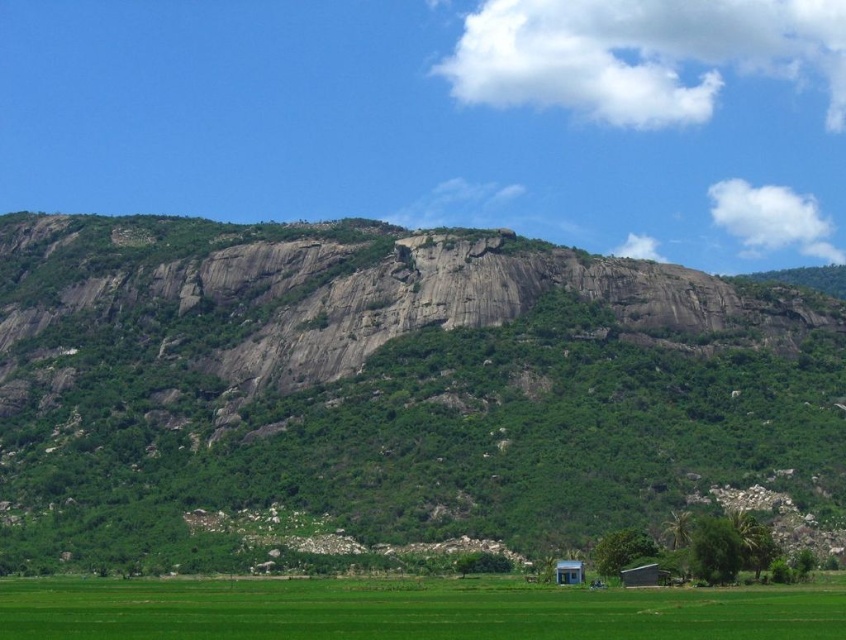
Question: Among these objects, which one is nearest to the camera?

Choices:
 (A) blue painted wood hut at lower center
 (B) white corrugated metal hut at lower right

Answer: (B)

Question: Considering the relative positions of green grass field at lower center and blue painted wood hut at lower center in the image provided, where is green grass field at lower center located with respect to blue painted wood hut at lower center?

Choices:
 (A) left
 (B) right

Answer: (A)

Question: Which point is closer to the camera taking this photo?

Choices:
 (A) [x=580, y=577]
 (B) [x=25, y=584]

Answer: (A)

Question: Does gray rock mountain at center appear on the left side of white corrugated metal hut at lower right?

Choices:
 (A) yes
 (B) no

Answer: (A)

Question: Can you confirm if green grass field at lower center is smaller than white corrugated metal hut at lower right?

Choices:
 (A) yes
 (B) no

Answer: (B)

Question: Which of the following is the closest to the observer?

Choices:
 (A) blue painted wood hut at lower center
 (B) white corrugated metal hut at lower right
 (C) green grass field at lower center
 (D) gray rock mountain at center

Answer: (C)